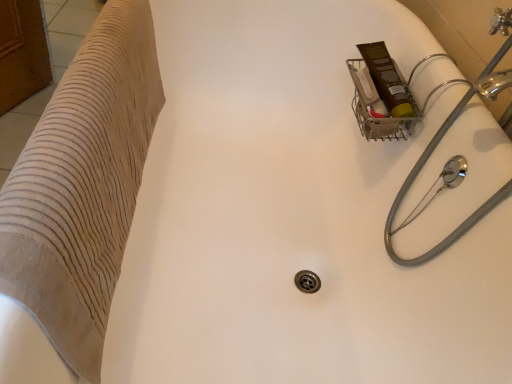
Locate an element on the screen. Image resolution: width=512 pixels, height=384 pixels. free point above beige textured towel at left (from a real-world perspective) is located at coordinates (75, 90).